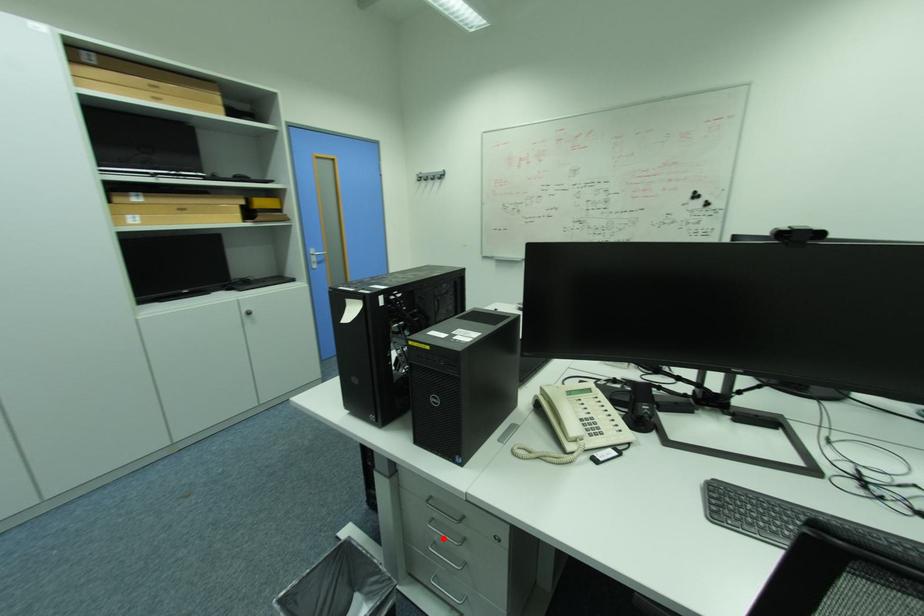
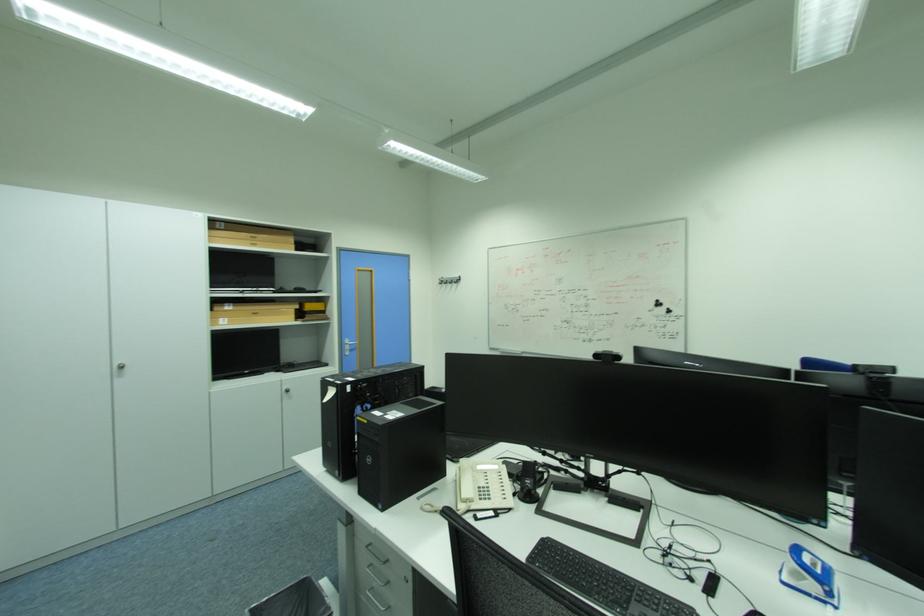
Find the pixel in the second image that matches the highlighted location in the first image.

(382, 585)